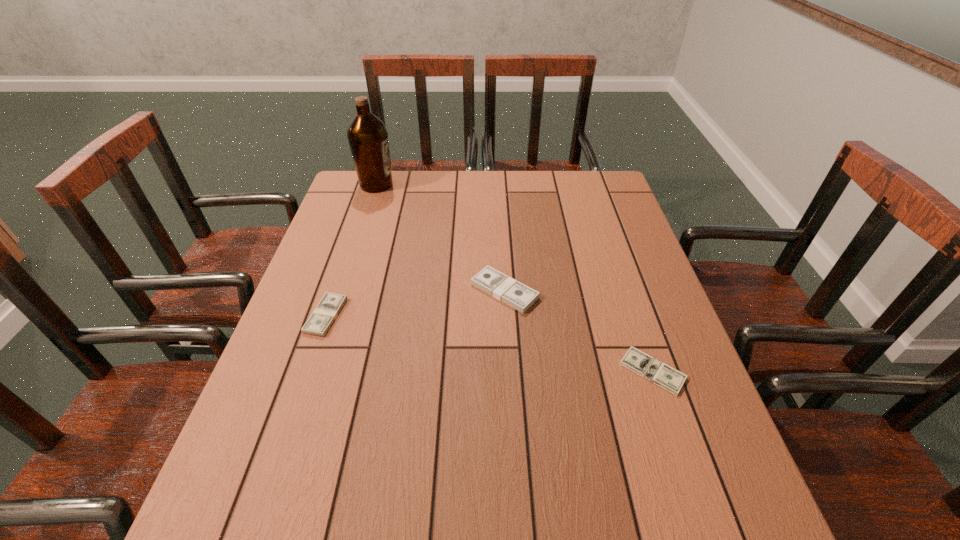
Locate an element on the screen. the tallest object is located at coordinates (367, 135).

Locate an element on the screen. This screenshot has height=540, width=960. olive oil is located at coordinates (367, 135).

Find the location of a particular element. This screenshot has width=960, height=540. the third shortest object is located at coordinates (500, 286).

The image size is (960, 540). I want to click on the third object from left to right, so click(500, 286).

The image size is (960, 540). What are the coordinates of `the second shortest dollar` in the screenshot? It's located at (330, 305).

Find the location of a particular element. the third tallest object is located at coordinates (330, 305).

I want to click on the rightmost dollar, so click(661, 374).

Find the location of a particular element. The height and width of the screenshot is (540, 960). the rightmost object is located at coordinates [661, 374].

The image size is (960, 540). I want to click on vacant space located on the label of the tallest object, so click(433, 185).

Find the location of a particular element. free space located on the back of the third object from left to right is located at coordinates pyautogui.click(x=501, y=234).